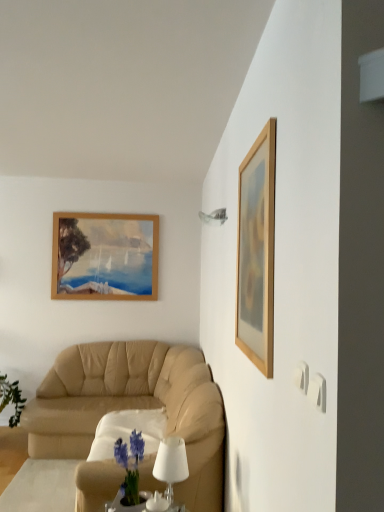
Question: From a real-world perspective, is wooden picture frame at upper right beneath metallic glass lampshade at upper center?

Choices:
 (A) yes
 (B) no

Answer: (A)

Question: Is wooden picture frame at upper right not inside metallic glass lampshade at upper center?

Choices:
 (A) no
 (B) yes

Answer: (B)

Question: Does wooden picture frame at upper right contain metallic glass lampshade at upper center?

Choices:
 (A) yes
 (B) no

Answer: (B)

Question: Does wooden picture frame at upper right have a lesser height compared to metallic glass lampshade at upper center?

Choices:
 (A) yes
 (B) no

Answer: (B)

Question: Does wooden picture frame at upper right touch metallic glass lampshade at upper center?

Choices:
 (A) no
 (B) yes

Answer: (A)

Question: Could you tell me if wooden picture frame at upper right is facing metallic glass lampshade at upper center?

Choices:
 (A) yes
 (B) no

Answer: (B)

Question: Considering the relative sizes of wooden picture frame at upper right and white matte table lamp at lower center in the image provided, is wooden picture frame at upper right shorter than white matte table lamp at lower center?

Choices:
 (A) no
 (B) yes

Answer: (A)

Question: Is white matte table lamp at lower center a part of wooden picture frame at upper right?

Choices:
 (A) no
 (B) yes

Answer: (A)

Question: Does wooden picture frame at upper right turn towards white matte table lamp at lower center?

Choices:
 (A) no
 (B) yes

Answer: (A)

Question: Can you confirm if wooden picture frame at upper right is wider than white matte table lamp at lower center?

Choices:
 (A) yes
 (B) no

Answer: (B)

Question: From the image's perspective, does wooden picture frame at upper right appear higher than white matte table lamp at lower center?

Choices:
 (A) yes
 (B) no

Answer: (A)

Question: Is wooden picture frame at upper right positioned with its back to white matte table lamp at lower center?

Choices:
 (A) yes
 (B) no

Answer: (B)

Question: From a real-world perspective, is white matte table lamp at lower center positioned under wooden picture frame at upper right based on gravity?

Choices:
 (A) no
 (B) yes

Answer: (B)